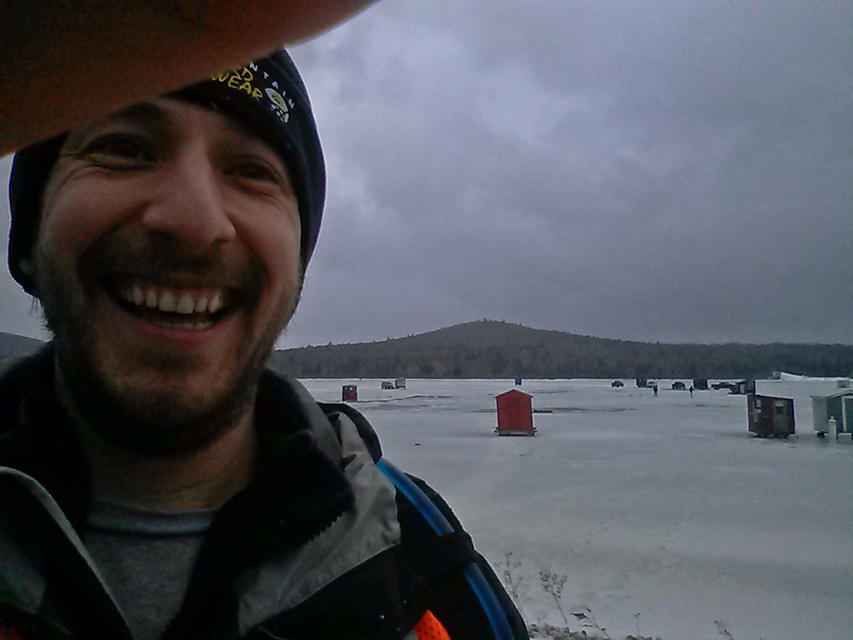
You are planning to take a winter photo where the person in the matte black jacket at center should be the main focus. Given that the white matte snow at center is a large area, will the jacket still be noticeable in the photo?

The matte black jacket at center occupies less space than the white matte snow at center, so it may not be as noticeable against the large white background.